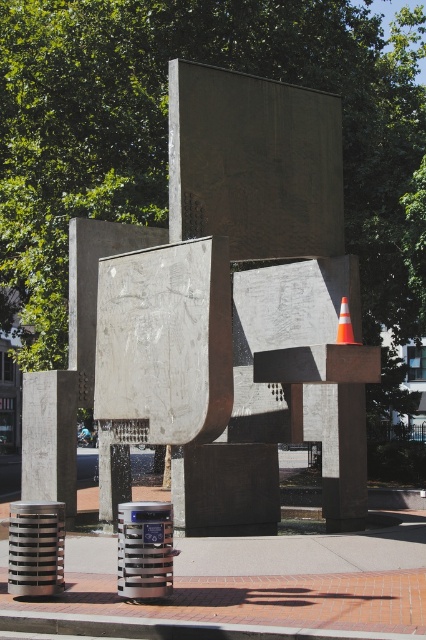
You are a delivery person who needs to park your vehicle 6 feet away from the orange reflective cone at center. Can you park your vehicle next to the smooth concrete sculpture at center?

The smooth concrete sculpture at center and orange reflective cone at center are 5.91 feet apart from each other. Since the required distance is 6 feet, you can park your vehicle next to the smooth concrete sculpture at center as the distance is just under the required limit.

You are a city planner assessing the sculpture and cone in the public square. You need to determine if the smooth concrete sculpture at center can be placed inside a storage container that can only accommodate items up to the size of the orange reflective cone at center. Based on their sizes, can the sculpture fit?

The smooth concrete sculpture at center is smaller than the orange reflective cone at center, so it can fit inside the storage container designed for the cone.

You are standing at the camera position and want to take a photo of the smooth concrete sculpture at center. If your camera has a maximum focus range of 10 meters, will you be able to capture the sculpture clearly?

The smooth concrete sculpture at center is 12.14 meters away from the camera, which exceeds the maximum focus range of 10 meters. Therefore, you won the sculpture clearly.